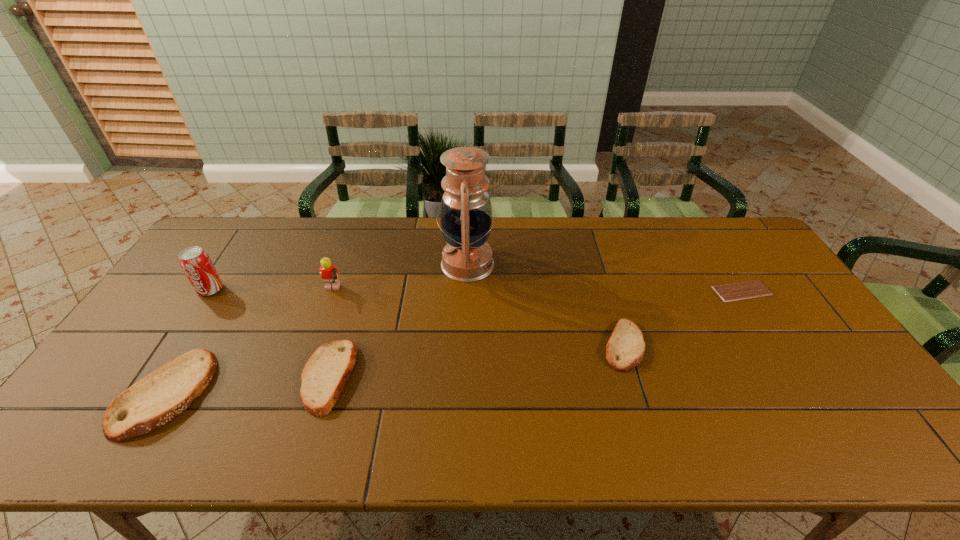
Where is `soda can`? This screenshot has height=540, width=960. soda can is located at coordinates (195, 262).

Locate an element on the screen. Image resolution: width=960 pixels, height=540 pixels. Lego is located at coordinates (329, 273).

Find the location of a particular element. free location located on the right of the fourth tallest object is located at coordinates (311, 394).

Locate an element on the screen. vacant space located on the left of the second pita bread from left to right is located at coordinates (174, 376).

The width and height of the screenshot is (960, 540). Identify the location of free location located 0.290m on the right of the second shortest object. (752, 345).

Locate an element on the screen. free space located 0.150m on the right of the tallest object is located at coordinates (540, 264).

Identify the location of free space located 0.100m on the front of the rightmost object. (765, 328).

The image size is (960, 540). I want to click on free location located 0.190m on the logo side of the second tallest object, so click(x=172, y=348).

You are a GUI agent. You are given a task and a screenshot of the screen. Output one action in this format:
    pyautogui.click(x=<x>, y=<y>)
    Task: Click on the free space located in front of the fifth shortest object with the accessory visible
    
    Given the screenshot: What is the action you would take?
    pyautogui.click(x=419, y=292)

This screenshot has width=960, height=540. In order to click on object present at the far edge in this screenshot , I will do `click(465, 213)`.